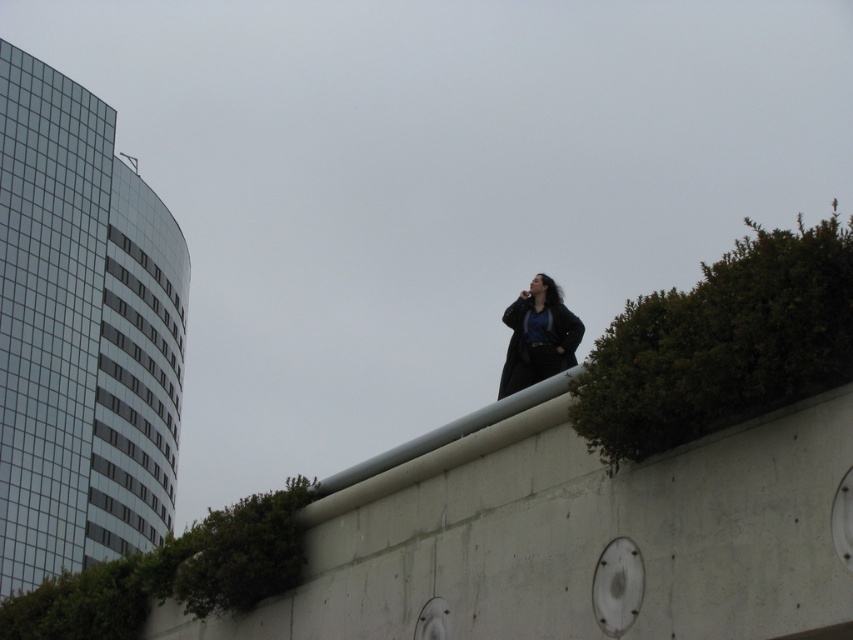
Question: Where is green leafy plant at lower left located in relation to matte black coat at upper center in the image?

Choices:
 (A) above
 (B) below

Answer: (B)

Question: Which point is farther from the camera taking this photo?

Choices:
 (A) (700, 342)
 (B) (292, 518)
 (C) (531, 316)

Answer: (C)

Question: Among these points, which one is farthest from the camera?

Choices:
 (A) (503, 396)
 (B) (287, 579)

Answer: (A)

Question: Is green leafy bush at upper right above green leafy plant at lower left?

Choices:
 (A) no
 (B) yes

Answer: (B)

Question: Considering the relative positions of green leafy plant at lower left and matte black coat at upper center in the image provided, where is green leafy plant at lower left located with respect to matte black coat at upper center?

Choices:
 (A) left
 (B) right

Answer: (A)

Question: Which is farther from the matte black coat at upper center?

Choices:
 (A) green leafy plant at lower left
 (B) green leafy bush at upper right

Answer: (B)